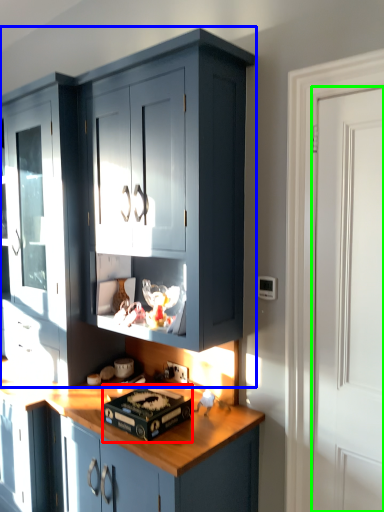
Question: Which is farther away from appliance (highlighted by a red box)? cabinetry (highlighted by a blue box) or door (highlighted by a green box)?

Choices:
 (A) cabinetry
 (B) door

Answer: (B)